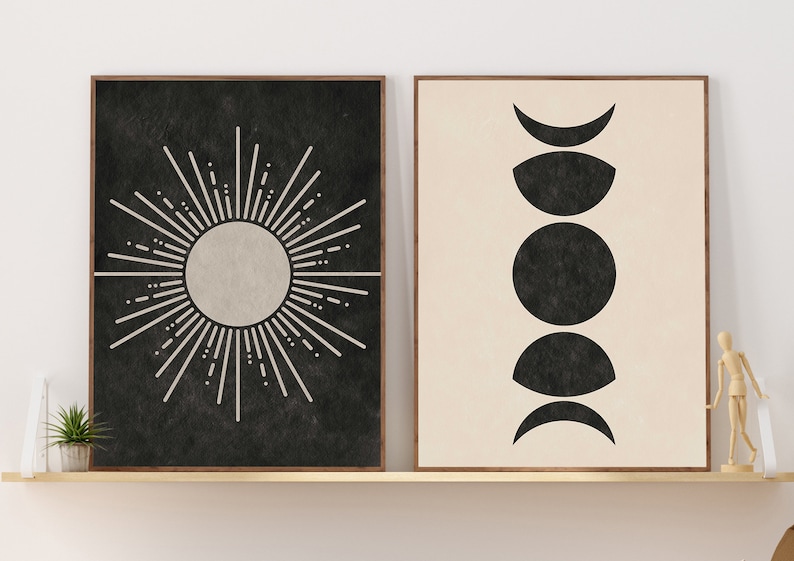
At what (x,y) coordinates should I click in order to perform the action: click on shelf. Please return your answer as a coordinate pair (x, y). This screenshot has height=561, width=794. Looking at the image, I should click on (403, 477).